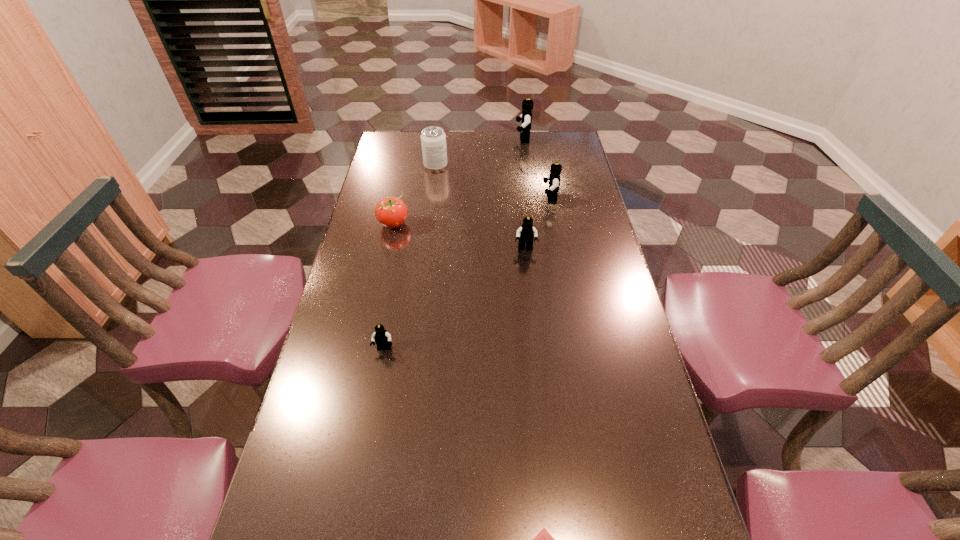
At what (x,y) coordinates should I click in order to perform the action: click on the second shortest Lego. Please return your answer as a coordinate pair (x, y). Looking at the image, I should click on (382, 338).

I want to click on vacant region located 0.100m on the front-facing side of the biggest black Lego, so click(492, 139).

Image resolution: width=960 pixels, height=540 pixels. What are the coordinates of `vacant space located 0.080m on the front-facing side of the biggest black Lego` in the screenshot? It's located at (496, 139).

Where is `free location located on the front-facing side of the biggest black Lego`? The height and width of the screenshot is (540, 960). free location located on the front-facing side of the biggest black Lego is located at coordinates (444, 139).

Identify the location of vacant space located on the front-facing side of the fourth nearest Lego. (447, 199).

In order to click on vacant region located 0.160m on the front-facing side of the fourth nearest Lego in this screenshot , I will do [498, 199].

The height and width of the screenshot is (540, 960). In order to click on vacant position located 0.190m on the front-facing side of the fourth nearest Lego in this screenshot , I will do `click(491, 199)`.

This screenshot has height=540, width=960. I want to click on vacant area located 0.130m on the left of the soda can, so click(392, 165).

What are the coordinates of `vacant space located on the front-facing side of the second nearest black Lego` in the screenshot? It's located at (530, 287).

This screenshot has height=540, width=960. Find the location of `vacant position located 0.360m on the right of the fourth nearest object`. vacant position located 0.360m on the right of the fourth nearest object is located at coordinates (516, 224).